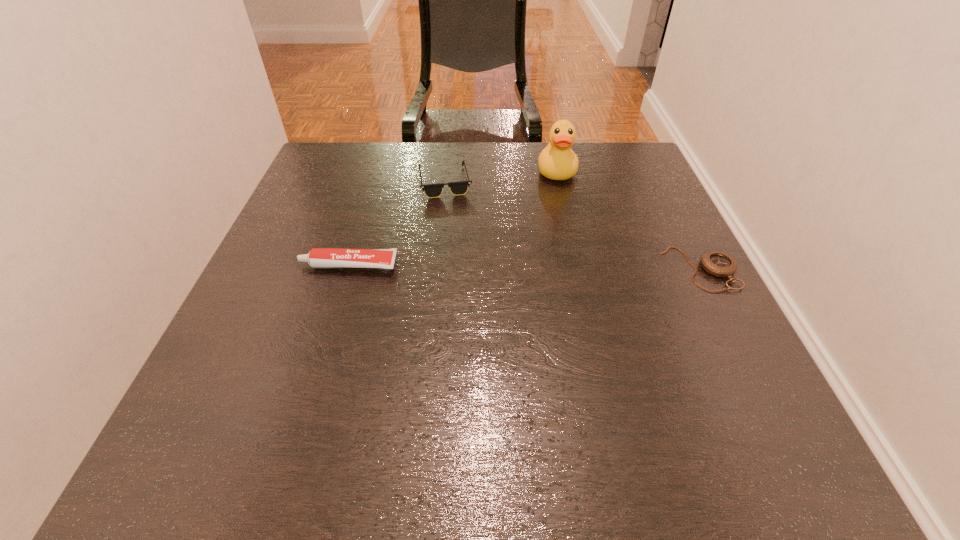
Where is `free space located 0.050m on the lenses of the second object from left to right`? The height and width of the screenshot is (540, 960). free space located 0.050m on the lenses of the second object from left to right is located at coordinates (472, 205).

Image resolution: width=960 pixels, height=540 pixels. What are the coordinates of `vacant space located 0.160m at the beak of the third object from left to right` in the screenshot? It's located at (562, 224).

What are the coordinates of `vacant space located 0.190m at the beak of the third object from left to right` in the screenshot? It's located at (562, 233).

This screenshot has width=960, height=540. I want to click on free space located at the beak of the third object from left to right, so click(564, 259).

The height and width of the screenshot is (540, 960). What are the coordinates of `sunglasses that is at the far edge` in the screenshot? It's located at (457, 188).

This screenshot has width=960, height=540. Identify the location of duck that is at the far edge. (557, 161).

Find the location of `object positioned at the left edge`. object positioned at the left edge is located at coordinates (318, 258).

This screenshot has width=960, height=540. In order to click on object that is at the right edge in this screenshot , I will do `click(717, 263)`.

The width and height of the screenshot is (960, 540). In order to click on vacant region at the far edge of the desktop in this screenshot , I will do `click(420, 171)`.

Find the location of `vacant area at the left edge`. vacant area at the left edge is located at coordinates (294, 352).